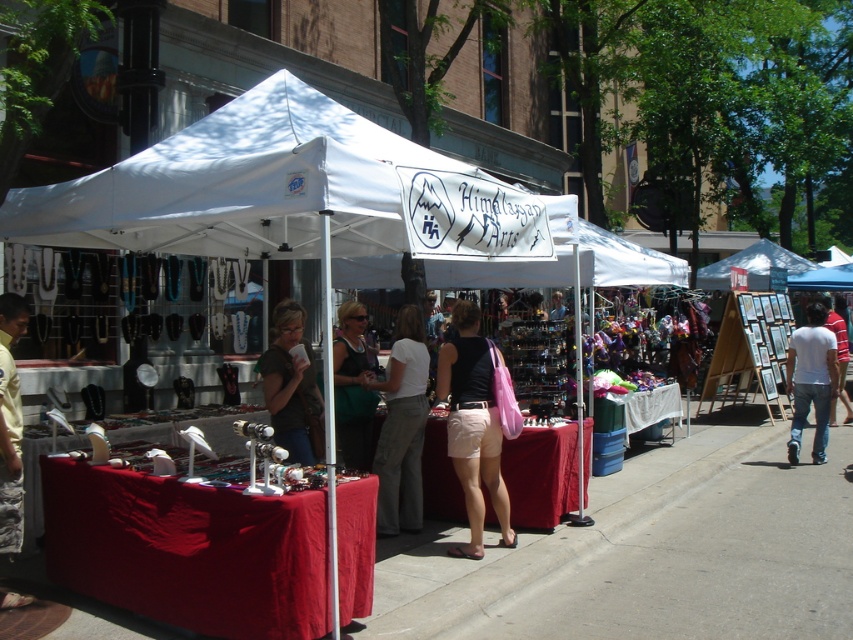
Question: Is white cotton shirt at right to the right of yellow fabric bag at lower left from the viewer's perspective?

Choices:
 (A) yes
 (B) no

Answer: (A)

Question: Which object is farther from the camera taking this photo?

Choices:
 (A) matte black shirt at center
 (B) white cotton shirt at right
 (C) pink fabric bag at center

Answer: (B)

Question: Can you confirm if green fabric tank top at center is smaller than blue fabric canopy at upper center?

Choices:
 (A) no
 (B) yes

Answer: (B)

Question: Which object is farther from the camera taking this photo?

Choices:
 (A) blue fabric canopy at upper center
 (B) white fabric canopy at center
 (C) light beige pants at center

Answer: (A)

Question: Can you confirm if pink fabric bag at center is positioned below yellow fabric bag at lower left?

Choices:
 (A) yes
 (B) no

Answer: (A)

Question: Which object appears closest to the camera in this image?

Choices:
 (A) white cotton shirt at right
 (B) white fabric canopy at center
 (C) matte black shirt at center
 (D) blue fabric canopy at upper center

Answer: (B)